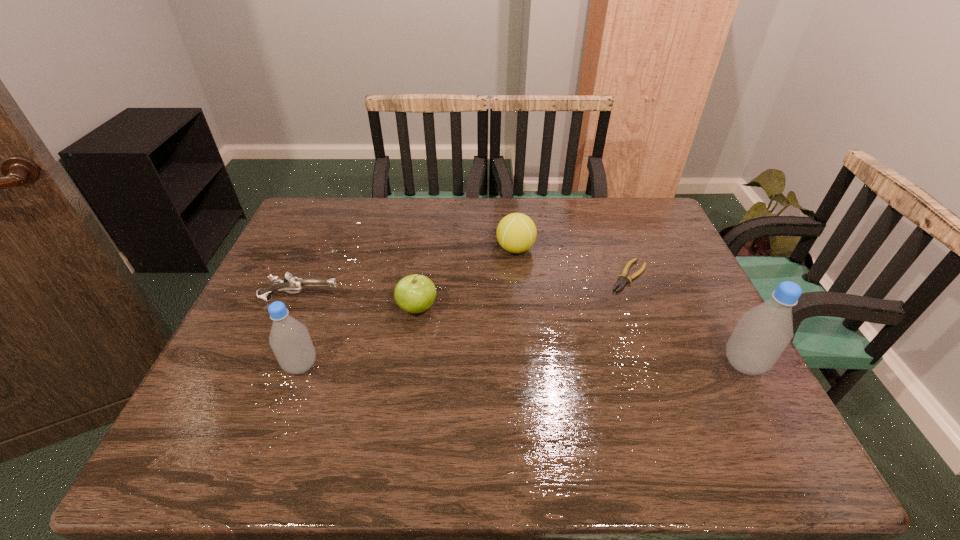
The image size is (960, 540). Identify the location of pliers positioned at the right edge. (621, 283).

In order to click on object positioned at the near right corner in this screenshot , I will do `click(763, 332)`.

At what (x,y) coordinates should I click in order to perform the action: click on free location at the far edge. Please return your answer as a coordinate pair (x, y). This screenshot has width=960, height=540. Looking at the image, I should click on (600, 224).

At what (x,y) coordinates should I click in order to perform the action: click on free space at the near edge. Please return your answer as a coordinate pair (x, y). Looking at the image, I should click on (650, 404).

Image resolution: width=960 pixels, height=540 pixels. In the image, there is a desktop. Find the location of `free space at the left edge`. free space at the left edge is located at coordinates (252, 338).

Where is `free space at the right edge of the desktop`? free space at the right edge of the desktop is located at coordinates (719, 351).

This screenshot has height=540, width=960. Identify the location of vacant space at the far right corner of the desktop. (620, 229).

The width and height of the screenshot is (960, 540). In order to click on blank space at the near right corner in this screenshot , I will do `click(753, 386)`.

At what (x,y) coordinates should I click in order to perform the action: click on free space between the fourth object from left to right and the shortest object. Please return your answer as a coordinate pair (x, y). The image size is (960, 540). Looking at the image, I should click on (572, 262).

The image size is (960, 540). I want to click on free point between the fifth object from left to right and the gun, so click(465, 287).